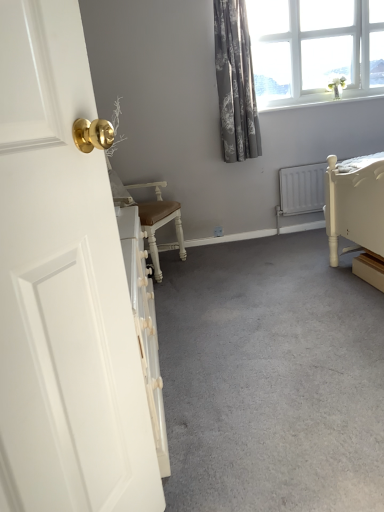
Describe the element at coordinates (235, 82) in the screenshot. I see `gray floral fabric curtain at upper right` at that location.

This screenshot has width=384, height=512. Find the location of `gray floral fabric curtain at upper right`. gray floral fabric curtain at upper right is located at coordinates (235, 82).

Does point (221, 99) appear closer or farther from the camera than point (289, 317)?

Point (221, 99) appears to be farther away from the viewer than point (289, 317).

Can gray carpet at center be found inside gray floral fabric curtain at upper right?

Actually, gray carpet at center is outside gray floral fabric curtain at upper right.

Does gray floral fabric curtain at upper right come in front of gray carpet at center?

No, it is behind gray carpet at center.

Considering the sizes of gray floral fabric curtain at upper right and gray carpet at center in the image, is gray floral fabric curtain at upper right bigger or smaller than gray carpet at center?

Clearly, gray floral fabric curtain at upper right is smaller in size than gray carpet at center.

Could gray carpet at center be considered to be inside white glass window at upper right?

No, gray carpet at center is not a part of white glass window at upper right.

Consider the image. From a real-world perspective, between white glass window at upper right and gray carpet at center, who is vertically lower?

From a 3D spatial view, gray carpet at center is below.

Considering the points (339, 16) and (371, 441), which point is behind, point (339, 16) or point (371, 441)?

Positioned behind is point (339, 16).

From the image's perspective, which object appears higher, white glass window at upper right or gray carpet at center?

white glass window at upper right, from the image's perspective.

Would you say white glass window at upper right is inside or outside white glossy door at left?

white glass window at upper right is not inside white glossy door at left, it's outside.

Is the surface of white glass window at upper right in direct contact with white glossy door at left?

No, white glass window at upper right is not touching white glossy door at left.

Can you tell me how much white glass window at upper right and white glossy door at left differ in facing direction?

The facing directions of white glass window at upper right and white glossy door at left are 59.4 degrees apart.

Considering the sizes of objects white glass window at upper right and white glossy door at left in the image provided, who is wider, white glass window at upper right or white glossy door at left?

With larger width is white glass window at upper right.

Is gray floral fabric curtain at upper right at the back of white glass window at upper right?

No.

Considering the relative positions of white glass window at upper right and gray floral fabric curtain at upper right in the image provided, is white glass window at upper right to the left of gray floral fabric curtain at upper right from the viewer's perspective?

Incorrect, white glass window at upper right is not on the left side of gray floral fabric curtain at upper right.

From the image's perspective, is white glass window at upper right beneath gray floral fabric curtain at upper right?

Incorrect, from the image's perspective, white glass window at upper right is higher than gray floral fabric curtain at upper right.

Based on their sizes in the image, would you say white glass window at upper right is bigger or smaller than gray floral fabric curtain at upper right?

white glass window at upper right is bigger than gray floral fabric curtain at upper right.

Between gray floral fabric curtain at upper right and white glass window at upper right, which one has smaller size?

Smaller between the two is gray floral fabric curtain at upper right.

From a real-world perspective, is gray floral fabric curtain at upper right positioned above or below white glass window at upper right?

From a real-world perspective, gray floral fabric curtain at upper right is physically below white glass window at upper right.

Is gray floral fabric curtain at upper right aimed at white glass window at upper right?

No.

Considering the positions of objects gray floral fabric curtain at upper right and white glass window at upper right in the image provided, who is more to the left, gray floral fabric curtain at upper right or white glass window at upper right?

gray floral fabric curtain at upper right is more to the left.

Does white glossy door at left turn towards white glass window at upper right?

No.

From the image's perspective, is white glossy door at left above or below white glass window at upper right?

white glossy door at left is situated lower than white glass window at upper right in the image.

Identify the location of door below the white glass window at upper right (from a real-world perspective). (63, 288).

Would you say white glossy door at left contains white glass window at upper right?

Definitely not — white glass window at upper right is not inside white glossy door at left.

Does white glossy door at left turn towards gray floral fabric curtain at upper right?

No, white glossy door at left is not oriented towards gray floral fabric curtain at upper right.

Looking at this image, is white glossy door at left behind gray floral fabric curtain at upper right?

No, white glossy door at left is in front of gray floral fabric curtain at upper right.

You are a GUI agent. You are given a task and a screenshot of the screen. Output one action in this format:
    pyautogui.click(x=<x>, y=<y>)
    Task: Click on the curtain positioned vertically above the white glossy door at left (from a real-world perspective)
    The width and height of the screenshot is (384, 512).
    Given the screenshot: What is the action you would take?
    pyautogui.click(x=235, y=82)

Where is `curtain located above the gray carpet at center (from a real-world perspective)`? Image resolution: width=384 pixels, height=512 pixels. curtain located above the gray carpet at center (from a real-world perspective) is located at coordinates (235, 82).

The height and width of the screenshot is (512, 384). What are the coordinates of `window on the right of the gray carpet at center` in the screenshot? It's located at (315, 49).

From the image, which object appears to be farther from gray carpet at center, white glossy door at left or white glass window at upper right?

white glass window at upper right is positioned further to the anchor gray carpet at center.

From the image, which object appears to be nearer to white glass window at upper right, gray floral fabric curtain at upper right or white glossy door at left?

The object closer to white glass window at upper right is gray floral fabric curtain at upper right.

Which object lies nearer to the anchor point white glossy door at left, gray floral fabric curtain at upper right or gray carpet at center?

gray carpet at center is positioned closer to the anchor white glossy door at left.

From the image, which object appears to be nearer to white glass window at upper right, white glossy door at left or gray carpet at center?

gray carpet at center is positioned closer to the anchor white glass window at upper right.

Estimate the real-world distances between objects in this image. Which object is closer to gray carpet at center, white glossy door at left or gray floral fabric curtain at upper right?

white glossy door at left.

From the image, which object appears to be nearer to gray carpet at center, gray floral fabric curtain at upper right or white glass window at upper right?

The object closer to gray carpet at center is gray floral fabric curtain at upper right.

Based on their spatial positions, is gray carpet at center or gray floral fabric curtain at upper right further from white glass window at upper right?

Among the two, gray carpet at center is located further to white glass window at upper right.

Looking at the image, which one is located closer to gray floral fabric curtain at upper right, white glass window at upper right or white glossy door at left?

white glass window at upper right is positioned closer to the anchor gray floral fabric curtain at upper right.

You are a GUI agent. You are given a task and a screenshot of the screen. Output one action in this format:
    pyautogui.click(x=<x>, y=<y>)
    Task: Click on the curtain between gray carpet at center and white glass window at upper right along the z-axis
    This screenshot has height=512, width=384.
    Given the screenshot: What is the action you would take?
    pyautogui.click(x=235, y=82)

The image size is (384, 512). I want to click on concrete between white glossy door at left and white glass window at upper right in the front-back direction, so click(271, 378).

Locate an element on the screen. Image resolution: width=384 pixels, height=512 pixels. curtain positioned between white glossy door at left and white glass window at upper right from near to far is located at coordinates (235, 82).

What are the coordinates of `concrete between white glossy door at left and gray floral fabric curtain at upper right in the front-back direction` in the screenshot? It's located at (271, 378).